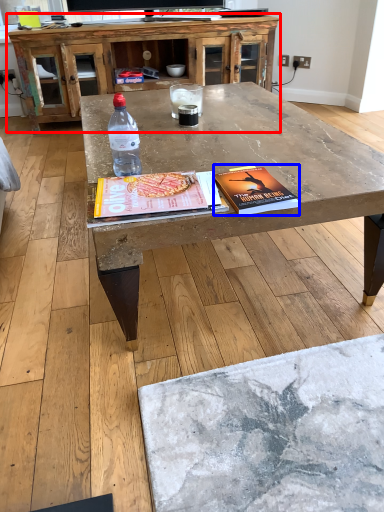
Question: Which point is further to the camera, cabinetry (highlighted by a red box) or paperback book (highlighted by a blue box)?

Choices:
 (A) cabinetry
 (B) paperback book

Answer: (A)